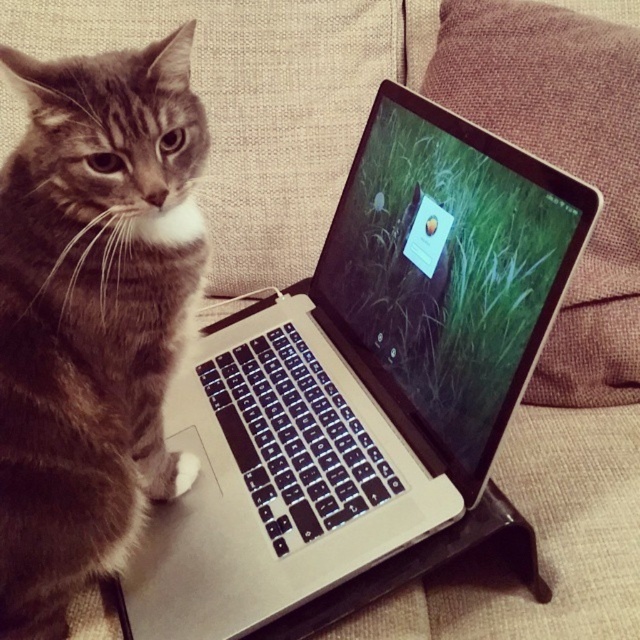
Can you confirm if tabby fur cat at left is positioned below matte black screen at center?

Yes, tabby fur cat at left is below matte black screen at center.

The width and height of the screenshot is (640, 640). Describe the element at coordinates (92, 314) in the screenshot. I see `tabby fur cat at left` at that location.

Which is in front, point (81, 252) or point (592, 339)?

Point (81, 252) is more forward.

Identify the location of tabby fur cat at left. This screenshot has width=640, height=640. (92, 314).

Where is `silver metallic laptop at center`? silver metallic laptop at center is located at coordinates (362, 384).

Does silver metallic laptop at center come in front of tabby fur cat at left?

Yes, silver metallic laptop at center is closer to the viewer.

Which is behind, point (184, 596) or point (113, 332)?

The point (184, 596) is behind.

Locate an element on the screen. Image resolution: width=640 pixels, height=640 pixels. silver metallic laptop at center is located at coordinates (362, 384).

Is silver metallic laptop at center below matte black screen at center?

Indeed, silver metallic laptop at center is positioned under matte black screen at center.

Is silver metallic laptop at center wider than matte black screen at center?

Indeed, silver metallic laptop at center has a greater width compared to matte black screen at center.

Between point (198, 621) and point (573, 26), which one is positioned in front?

Point (198, 621) is in front.

The height and width of the screenshot is (640, 640). I want to click on silver metallic laptop at center, so click(362, 384).